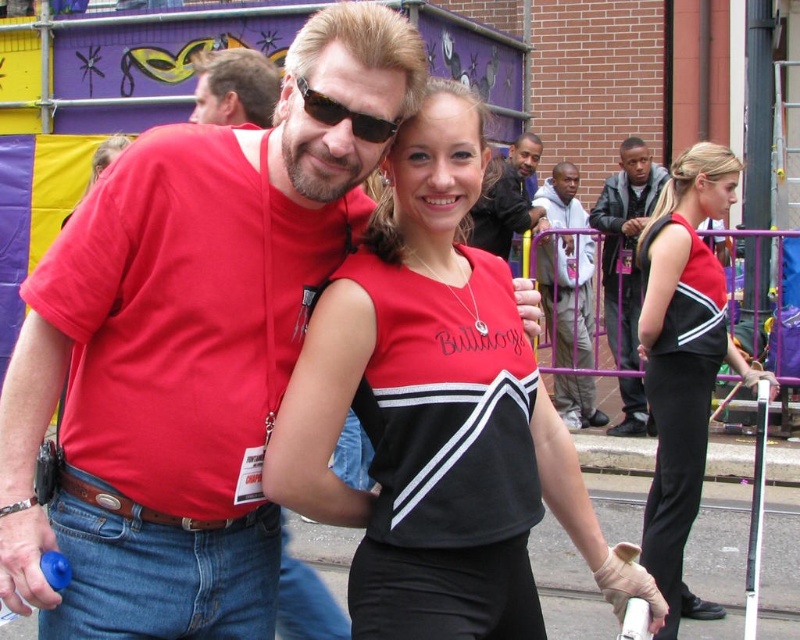
You are a photographer trying to capture a clear shot of both the black leather jacket at right and the sunglasses at center. Based on their positions, which object should you focus on first to ensure both are in focus?

The black leather jacket at right is closer to you than the sunglasses at center, so you should focus on the black leather jacket at right first. This way, the sunglasses at center will also be in focus since it is further away.